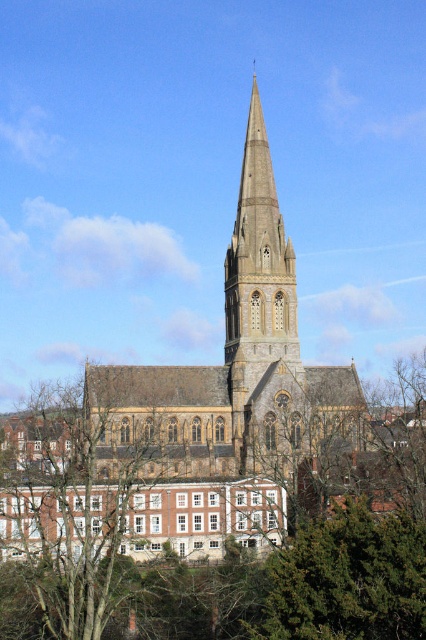
Question: Can you confirm if green leafy tree at center is positioned above brown wood tree at lower left?

Choices:
 (A) no
 (B) yes

Answer: (B)

Question: Which object is farther from the camera taking this photo?

Choices:
 (A) green leafy tree at center
 (B) brown wood tree at lower left

Answer: (B)

Question: Which object is farther from the camera taking this photo?

Choices:
 (A) green leafy tree at center
 (B) brown wood tree at lower left

Answer: (B)

Question: Is the position of green leafy tree at center less distant than that of brown wood tree at lower left?

Choices:
 (A) yes
 (B) no

Answer: (A)

Question: Is green leafy tree at center positioned at the back of brown wood tree at lower left?

Choices:
 (A) yes
 (B) no

Answer: (B)

Question: Among these points, which one is farthest from the camera?

Choices:
 (A) (5, 552)
 (B) (296, 500)

Answer: (B)